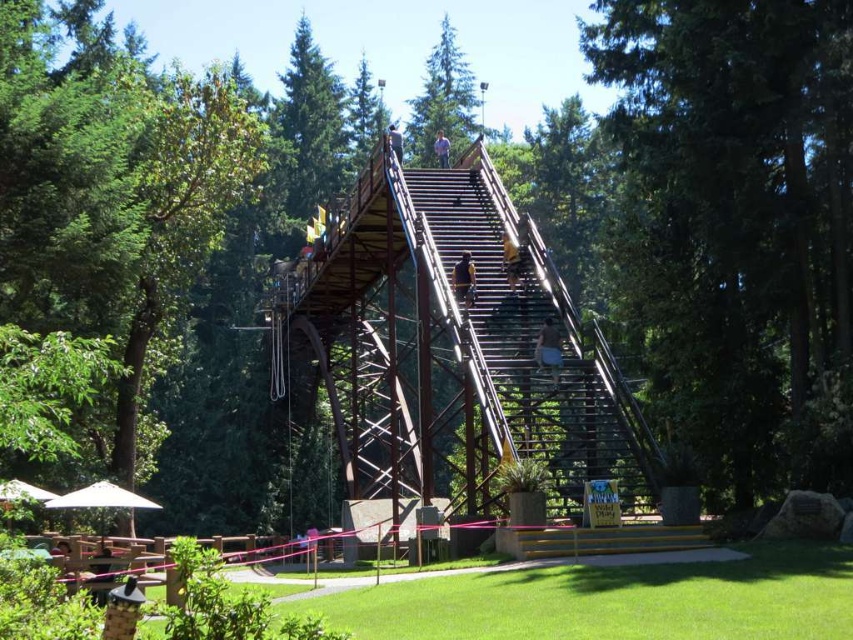
Question: Can you confirm if metallic silver helmet at upper center is smaller than light blue shirt at upper center?

Choices:
 (A) no
 (B) yes

Answer: (B)

Question: Which of the following is the closest to the observer?

Choices:
 (A) (606, 426)
 (B) (465, 288)
 (C) (445, 161)
 (D) (192, 115)

Answer: (A)

Question: Is the position of rustic wood stairs at center more distant than that of dark gray metal person at upper center?

Choices:
 (A) no
 (B) yes

Answer: (A)

Question: Does rustic wood stairs at center appear under dark brown wooden stairs at center?

Choices:
 (A) yes
 (B) no

Answer: (A)

Question: Estimate the real-world distances between objects in this image. Which object is farther from the dark brown wooden stairs at center?

Choices:
 (A) dark gray metal person at upper center
 (B) light blue shirt at upper center
 (C) metallic silver helmet at upper center

Answer: (B)

Question: Which point appears closest to the camera in this image?

Choices:
 (A) (461, 259)
 (B) (38, 324)
 (C) (434, 145)
 (D) (431, 177)

Answer: (A)